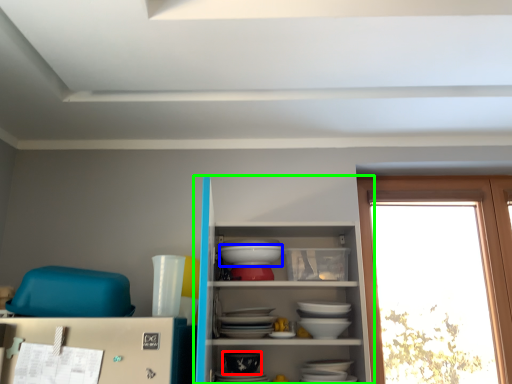
Question: Which is nearer to the tableware (highlighted by a red box)? table (highlighted by a blue box) or shelf (highlighted by a green box).

Choices:
 (A) table
 (B) shelf

Answer: (B)